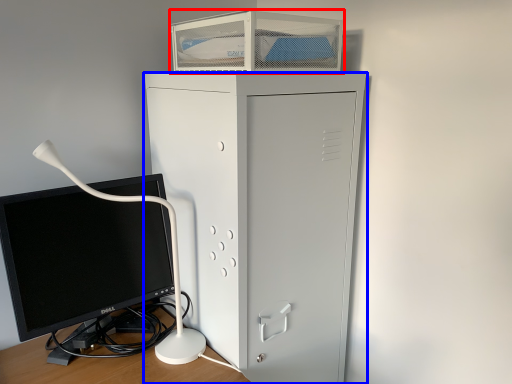
Question: Among these objects, which one is farthest to the camera, desktop (highlighted by a red box) or furniture (highlighted by a blue box)?

Choices:
 (A) desktop
 (B) furniture

Answer: (A)